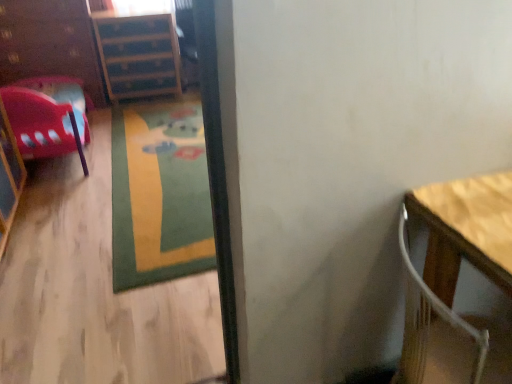
Question: Is wooden table at right in front of or behind wooden floor at lower left in the image?

Choices:
 (A) behind
 (B) front

Answer: (A)

Question: Considering the positions of wooden table at right and wooden floor at lower left in the image, is wooden table at right taller or shorter than wooden floor at lower left?

Choices:
 (A) short
 (B) tall

Answer: (A)

Question: Based on their relative distances, which object is farther from the wooden table at right?

Choices:
 (A) brushed wood dresser at left
 (B) wooden floor at lower left
 (C) matte plastic chair at left
 (D) green carpet at center
 (E) wooden file cabinet at upper left

Answer: (A)

Question: Estimate the real-world distances between objects in this image. Which object is farther from the wooden table at right?

Choices:
 (A) green carpet at center
 (B) matte plastic chair at left
 (C) wooden floor at lower left
 (D) wooden file cabinet at upper left
 (E) brushed wood dresser at left

Answer: (E)